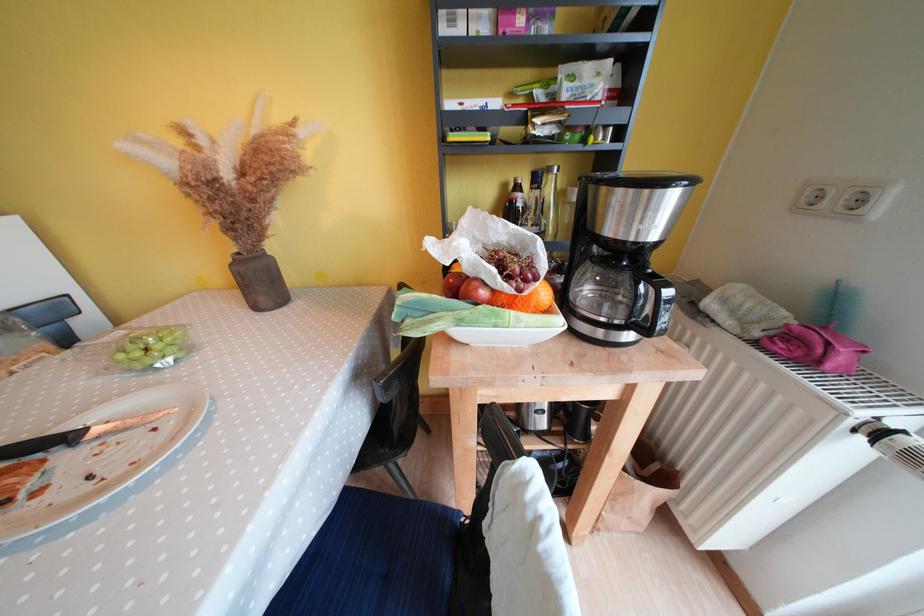
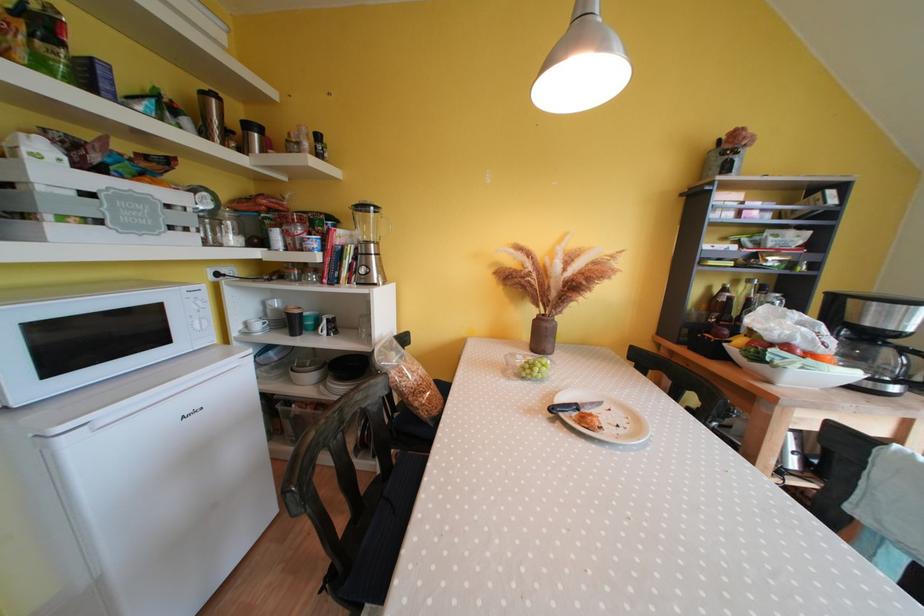
The point at (78, 442) is marked in the first image. Where is the corresponding point in the second image?

(582, 410)